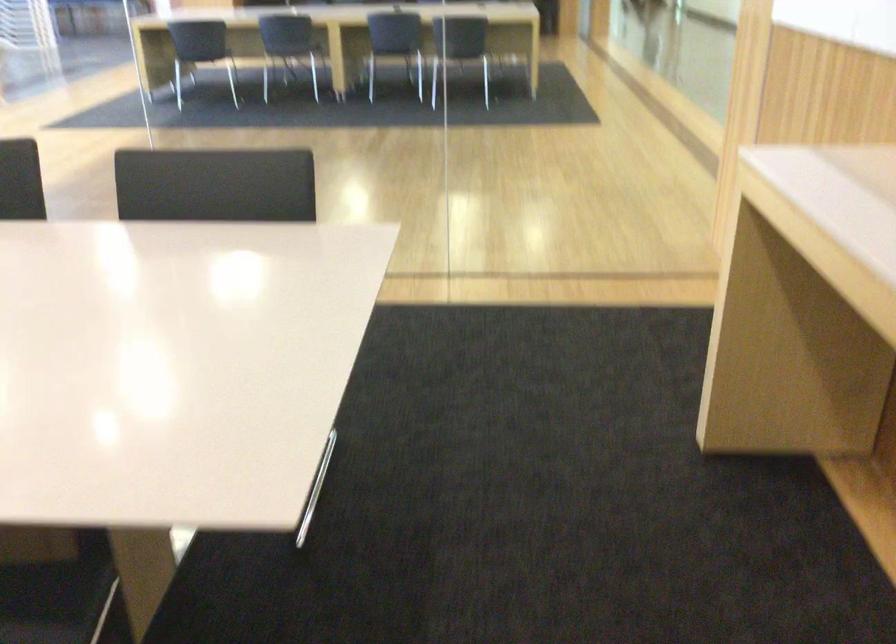
Find where to sit the chair sitting surface. Please return your answer as a coordinate pair (x, y).

(55, 601)